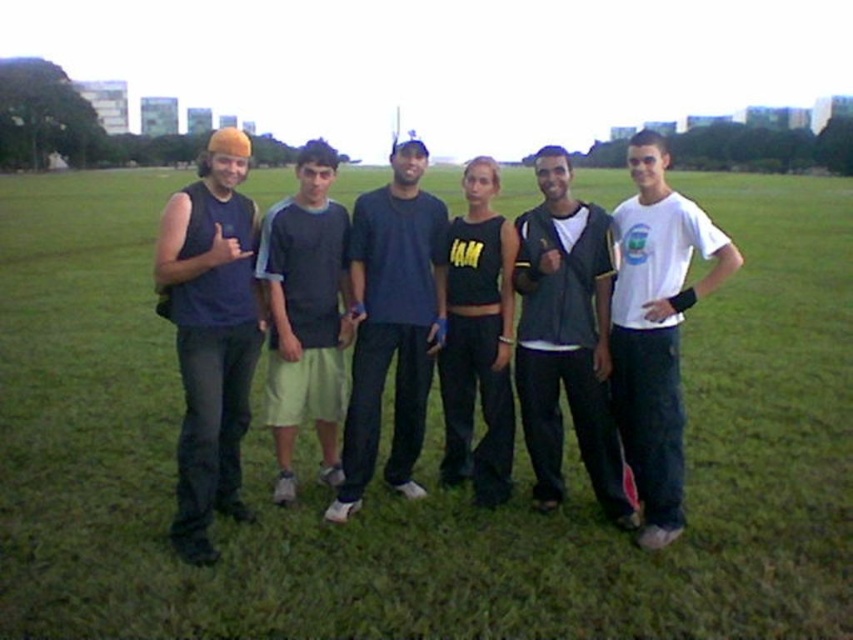
Please provide the coordinates of the dark gray jacket at center in the image. The image has a coordinate system where the bottom left corner is the origin point. The coordinates are given in normalized values between 0 and 1. The scene is a group of six people standing on a grassy field in a park. The jacket is part of the clothing worn by one of the individuals. Please answer with the coordinates as a pair in parentheses.

The dark gray jacket at center is located at coordinates point (x=566, y=339).